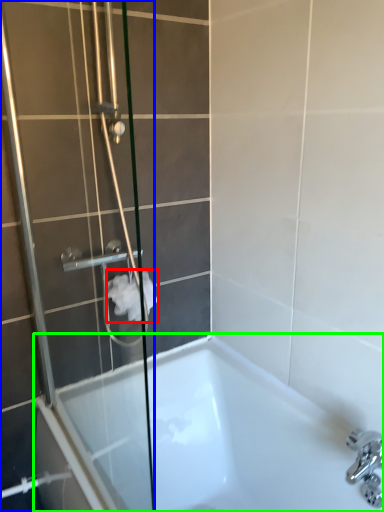
Question: Which is nearer to the toilet paper (highlighted by a red box)? shower door (highlighted by a blue box) or bathtub (highlighted by a green box).

Choices:
 (A) shower door
 (B) bathtub

Answer: (A)